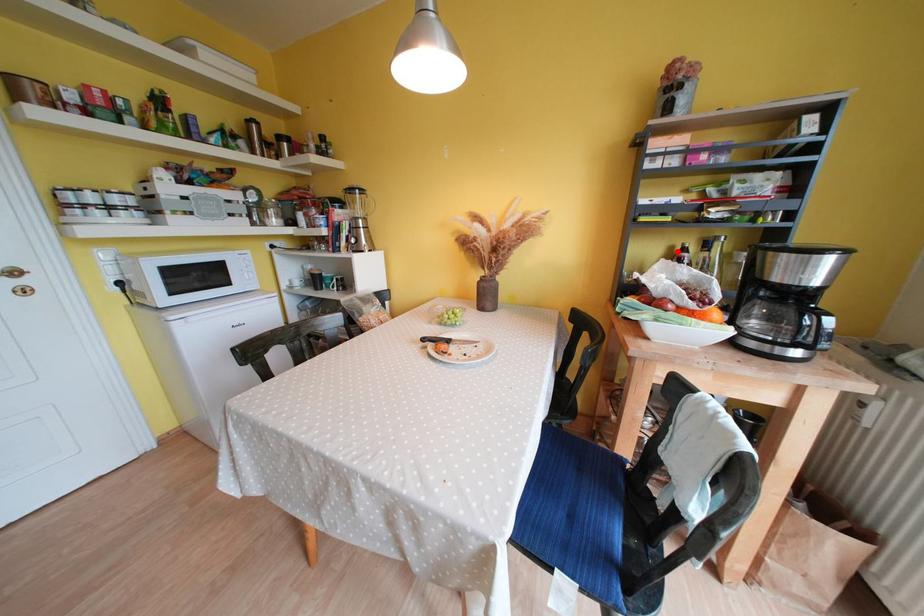
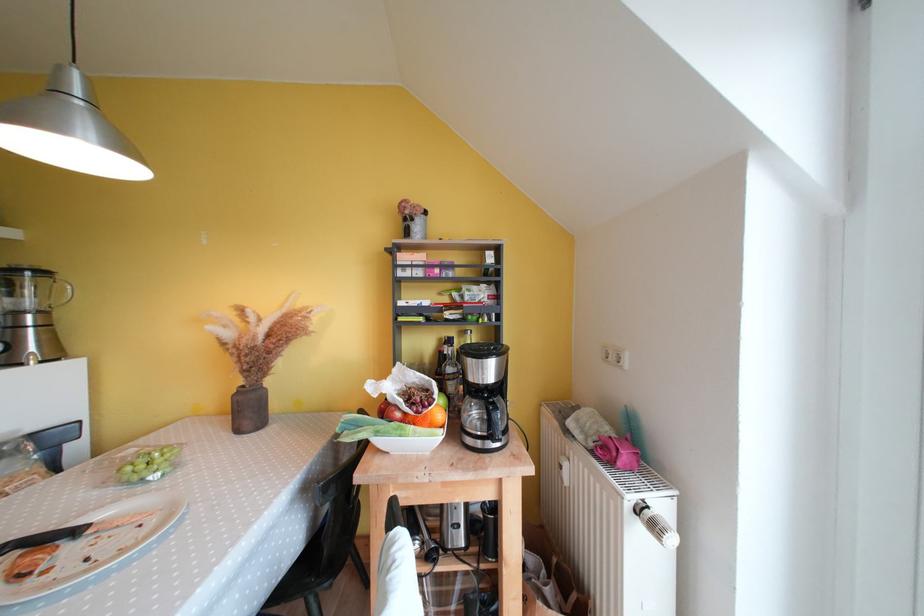
Question: I am providing you with two images of the same scene from different viewpoints. A red point is marked on the first image. Is the red point's position out of view in image 2?

Choices:
 (A) Yes
 (B) No

Answer: (B)